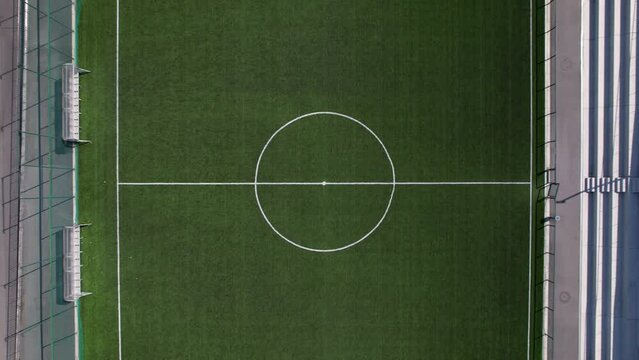
Image resolution: width=639 pixels, height=360 pixels. I want to click on bench, so click(x=77, y=267).